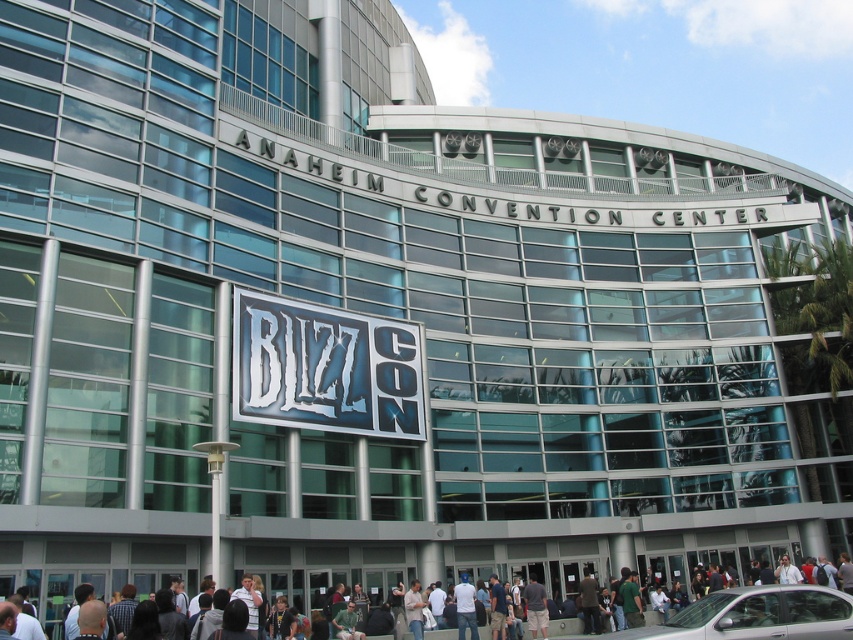
You are attending BlizzCon and need to park your car, which is 1.8 meters wide. There is a parking spot next to the dark blue shirt at lower center. Can your car fit in the parking spot if the spot is as wide as the silver metallic car at lower right?

The silver metallic car at lower right has a lesser width compared to the dark blue shirt at lower center. Since the parking spot is as wide as the silver metallic car at lower right, and your car is 1.8 meters wide, you need to compare the car width with the spot width. However, the description only states the relative width between the car and the shirt, not their actual sizes. Without knowing the actual width of the parking spot, it is impossible to determine if your car will fit.

You are attending BlizzCon and want to take a photo of the convention center sign while standing near the dark blue shirt at lower center. Can you see the silver metallic car at lower right in your shot if you face the convention center?

The silver metallic car at lower right is to the right of the dark blue shirt at lower center. Since you are facing the convention center, the car would be positioned to your right side. Depending on the camera angle and field of view, it might be visible in the shot if you include the right side of your frame.

You are standing at the front entrance of the Anaheim Convention Center and see a silver metallic car at lower right and a dark blue shirt at lower center. Which object is closer to you?

The silver metallic car at lower right is positioned over dark blue shirt at lower center, meaning it is closer to you.